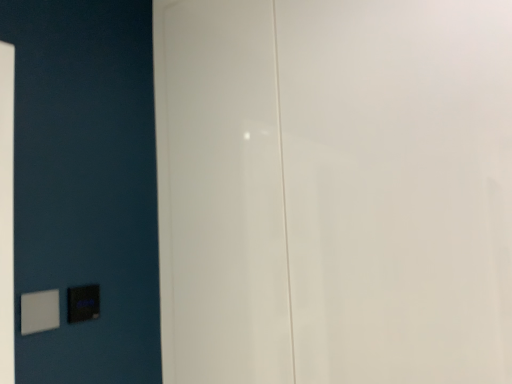
Find the location of a particular element. This screenshot has width=512, height=384. white glossy door at center is located at coordinates (334, 190).

The width and height of the screenshot is (512, 384). Identify the location of light switch above the matte black switch at lower left, the second light switch in the left-to-right sequence (from the image's perspective). (39, 311).

Is white plastic light switch at lower left, which ranks as the first light switch in front-to-back order, not near matte black switch at lower left, the second light switch in the left-to-right sequence?

They are positioned close to each other.

Could you tell me if white plastic light switch at lower left, which is the 2th light switch in right-to-left order, is turned towards matte black switch at lower left, the first light switch in the back-to-front sequence?

No, white plastic light switch at lower left, which is the 2th light switch in right-to-left order, does not turn towards matte black switch at lower left, the first light switch in the back-to-front sequence.

Which object is more forward, white plastic light switch at lower left, which ranks as the first light switch in front-to-back order, or matte black switch at lower left, the first light switch in the back-to-front sequence?

white plastic light switch at lower left, which ranks as the first light switch in front-to-back order, is closer to the camera.

At what (x,y) coordinates should I click in order to perform the action: click on the 2nd light switch below the white glossy door at center (from the image's perspective). Please return your answer as a coordinate pair (x, y). The width and height of the screenshot is (512, 384). Looking at the image, I should click on (83, 303).

Considering the relative positions of matte black switch at lower left, the first light switch in the back-to-front sequence, and white glossy door at center in the image provided, is matte black switch at lower left, the first light switch in the back-to-front sequence, behind white glossy door at center?

Yes, it is behind white glossy door at center.

Would you consider matte black switch at lower left, which is counted as the 2th light switch, starting from the front, to be distant from white glossy door at center?

matte black switch at lower left, which is counted as the 2th light switch, starting from the front, is near white glossy door at center, not far away.

How much distance is there between matte black switch at lower left, the 1th light switch from the right, and white glossy door at center?

The distance of matte black switch at lower left, the 1th light switch from the right, from white glossy door at center is 25.86 inches.

Does white plastic light switch at lower left, the second light switch when ordered from back to front, have a greater height compared to white glossy door at center?

In fact, white plastic light switch at lower left, the second light switch when ordered from back to front, may be shorter than white glossy door at center.

From the image's perspective, between white plastic light switch at lower left, which is the 2th light switch in right-to-left order, and white glossy door at center, who is located below?

From the image's view, white plastic light switch at lower left, which is the 2th light switch in right-to-left order, is below.

From a real-world perspective, is white plastic light switch at lower left, which ranks as the first light switch in front-to-back order, below white glossy door at center?

Yes.

Who is smaller, white plastic light switch at lower left, which ranks as the first light switch in front-to-back order, or white glossy door at center?

Smaller between the two is white plastic light switch at lower left, which ranks as the first light switch in front-to-back order.

Which light switch is the 2nd one when counting from the back of the white glossy door at center? Please provide its 2D coordinates.

[(83, 303)]

Considering the sizes of objects white glossy door at center and matte black switch at lower left, the first light switch in the back-to-front sequence, in the image provided, who is thinner, white glossy door at center or matte black switch at lower left, the first light switch in the back-to-front sequence,?

matte black switch at lower left, the first light switch in the back-to-front sequence.

In the scene shown: Is white glossy door at center next to matte black switch at lower left, which is counted as the 2th light switch, starting from the front?

white glossy door at center and matte black switch at lower left, which is counted as the 2th light switch, starting from the front, are not in contact.

What's the angular difference between matte black switch at lower left, the 1th light switch from the right, and white plastic light switch at lower left, which is the 2th light switch in right-to-left order,'s facing directions?

There is a 0.00443-degree angle between the facing directions of matte black switch at lower left, the 1th light switch from the right, and white plastic light switch at lower left, which is the 2th light switch in right-to-left order.

Is matte black switch at lower left, the 1th light switch from the right, oriented towards white plastic light switch at lower left, the second light switch when ordered from back to front?

No.

Is matte black switch at lower left, the 1th light switch from the right, at the left side of white plastic light switch at lower left, the second light switch when ordered from back to front?

In fact, matte black switch at lower left, the 1th light switch from the right, is to the right of white plastic light switch at lower left, the second light switch when ordered from back to front.

Locate an element on the screen. Image resolution: width=512 pixels, height=384 pixels. light switch above the matte black switch at lower left, the second light switch in the left-to-right sequence (from the image's perspective) is located at coordinates (39, 311).

Is white glossy door at center inside the boundaries of white plastic light switch at lower left, which is the 2th light switch in right-to-left order, or outside?

white glossy door at center is not inside white plastic light switch at lower left, which is the 2th light switch in right-to-left order, it's outside.

From the image's perspective, is white glossy door at center under white plastic light switch at lower left, which ranks as the first light switch in front-to-back order?

Actually, white glossy door at center appears above white plastic light switch at lower left, which ranks as the first light switch in front-to-back order, in the image.

In the image, is white glossy door at center positioned in front of or behind white plastic light switch at lower left, which ranks as the first light switch in front-to-back order?

Visually, white glossy door at center is located in front of white plastic light switch at lower left, which ranks as the first light switch in front-to-back order.

Is white plastic light switch at lower left, which is the 2th light switch in right-to-left order, at the back of white glossy door at center?

No.

Locate an element on the screen. The height and width of the screenshot is (384, 512). light switch below the white plastic light switch at lower left, the first light switch positioned from the left (from the image's perspective) is located at coordinates (83, 303).

This screenshot has width=512, height=384. Identify the location of door located in front of the matte black switch at lower left, the first light switch in the back-to-front sequence. click(334, 190).

From the image, which object appears to be farther from white glossy door at center, matte black switch at lower left, the first light switch in the back-to-front sequence, or white plastic light switch at lower left, the first light switch positioned from the left?

Based on the image, white plastic light switch at lower left, the first light switch positioned from the left, appears to be further to white glossy door at center.

From the image, which object appears to be nearer to white plastic light switch at lower left, the first light switch positioned from the left, white glossy door at center or matte black switch at lower left, the first light switch in the back-to-front sequence?

matte black switch at lower left, the first light switch in the back-to-front sequence, lies closer to white plastic light switch at lower left, the first light switch positioned from the left, than the other object.

When comparing their distances from white plastic light switch at lower left, the first light switch positioned from the left, does matte black switch at lower left, the 1th light switch from the right, or white glossy door at center seem closer?

matte black switch at lower left, the 1th light switch from the right.

Based on their spatial positions, is white plastic light switch at lower left, the second light switch when ordered from back to front, or white glossy door at center further from matte black switch at lower left, the 1th light switch from the right?

white glossy door at center.

Which object lies further to the anchor point white glossy door at center, white plastic light switch at lower left, the second light switch when ordered from back to front, or matte black switch at lower left, the 1th light switch from the right?

The object further to white glossy door at center is white plastic light switch at lower left, the second light switch when ordered from back to front.

Estimate the real-world distances between objects in this image. Which object is further from matte black switch at lower left, the first light switch in the back-to-front sequence, white glossy door at center or white plastic light switch at lower left, the first light switch positioned from the left?

white glossy door at center is positioned further to the anchor matte black switch at lower left, the first light switch in the back-to-front sequence.

The width and height of the screenshot is (512, 384). In order to click on light switch located between white plastic light switch at lower left, which ranks as the first light switch in front-to-back order, and white glossy door at center in the left-right direction in this screenshot , I will do `click(83, 303)`.